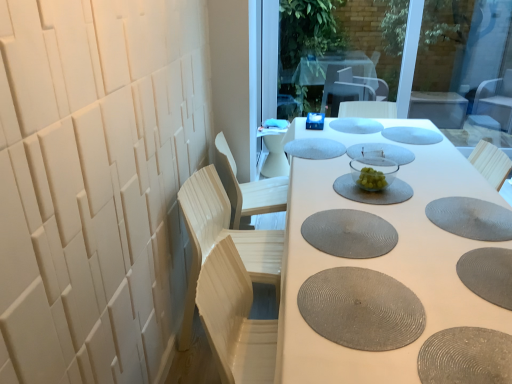
You are a GUI agent. You are given a task and a screenshot of the screen. Output one action in this format:
    pyautogui.click(x=<x>, y=<y>)
    Task: Click on the vacant area in front of clear glass bowl at center, placed as the seventh manhole cover when sorted from front to back
    The height and width of the screenshot is (384, 512).
    Given the screenshot: What is the action you would take?
    pyautogui.click(x=396, y=173)